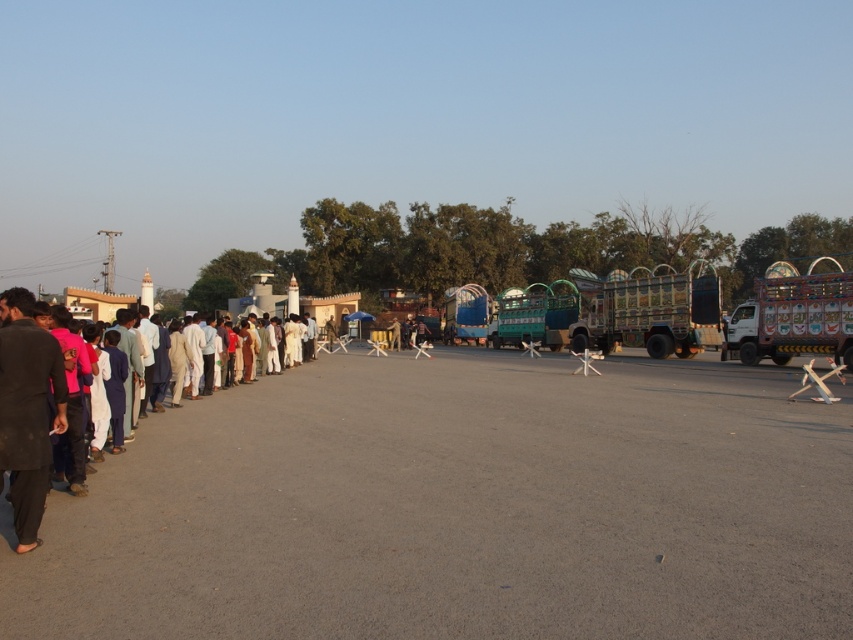
You are a photographer trying to capture a person wearing both dark brown fabric shirt at left and dark brown fabric pants at left in a single frame. Considering their positions, will the shirt and pants appear thinner in the photo?

The dark brown fabric shirt at left is thinner than the dark brown fabric pants at left, so in the photo, the shirt will appear thinner than the pants.

You are standing at the point closer to the camera between the two points, point (10, 332) and point (12, 365). Which point are you standing at?

You are standing at point (10, 332) because it is further to the camera than point (12, 365).

You are a photographer trying to capture a person wearing dark brown fabric shirt at left and dark brown fabric pants at left. From which side of the pants should you position yourself to ensure the shirt is fully visible in the frame?

The dark brown fabric shirt at left is positioned on the right side of dark brown fabric pants at left, so positioning yourself to the right of the pants will allow the shirt to be fully visible.